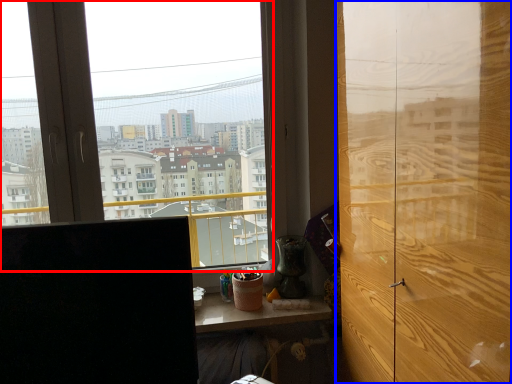
Question: Which point is further to the camera, window (highlighted by a red box) or door (highlighted by a blue box)?

Choices:
 (A) window
 (B) door

Answer: (A)